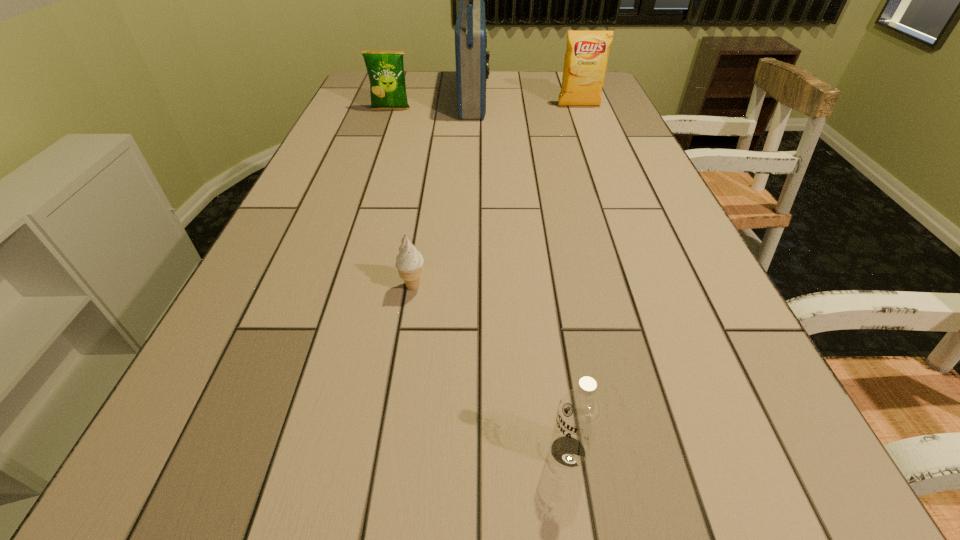
This screenshot has height=540, width=960. I want to click on free spot located on the front panel of the tallest object, so click(x=525, y=98).

I want to click on free space located on the front of the taller crisp (potato chip) with the logo, so click(x=598, y=155).

You are a GUI agent. You are given a task and a screenshot of the screen. Output one action in this format:
    pyautogui.click(x=<x>, y=<y>)
    Task: Click on the vacant area situated 0.320m on the front-facing side of the shorter crisp (potato chip)
    Image resolution: width=960 pixels, height=540 pixels.
    Given the screenshot: What is the action you would take?
    pyautogui.click(x=372, y=164)

The height and width of the screenshot is (540, 960). I want to click on blank space located on the front label of the vodka, so click(369, 451).

Where is `blank space located 0.340m on the front label of the vodka`? blank space located 0.340m on the front label of the vodka is located at coordinates (303, 451).

Where is `free region located 0.320m on the front label of the vodka`? free region located 0.320m on the front label of the vodka is located at coordinates (318, 451).

You are a GUI agent. You are given a task and a screenshot of the screen. Output one action in this format:
    pyautogui.click(x=<x>, y=<y>)
    Task: Click on the vacant space located on the front-facing side of the shortest object
    This screenshot has height=540, width=960.
    Given the screenshot: What is the action you would take?
    pyautogui.click(x=378, y=517)

The image size is (960, 540). Identify the location of object positioned at the far edge. (472, 60).

The image size is (960, 540). I want to click on object that is at the left edge, so click(x=385, y=69).

Find the location of a particular element. The height and width of the screenshot is (540, 960). object that is at the right edge is located at coordinates point(586,58).